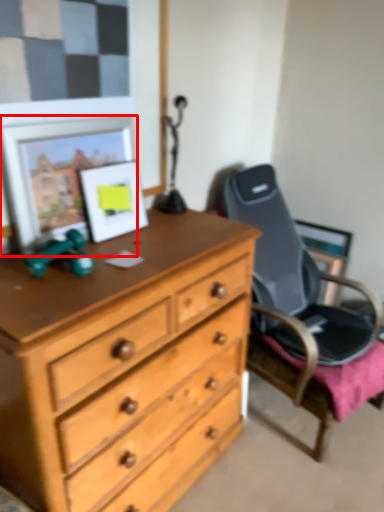
Question: From the image's perspective, where is picture frame (annotated by the red box) located relative to picture frame?

Choices:
 (A) above
 (B) below

Answer: (A)